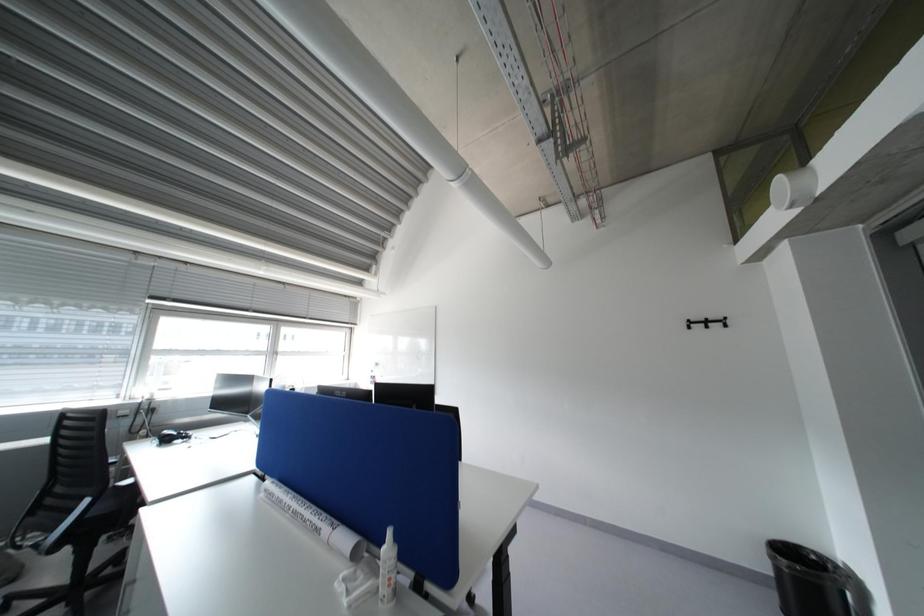
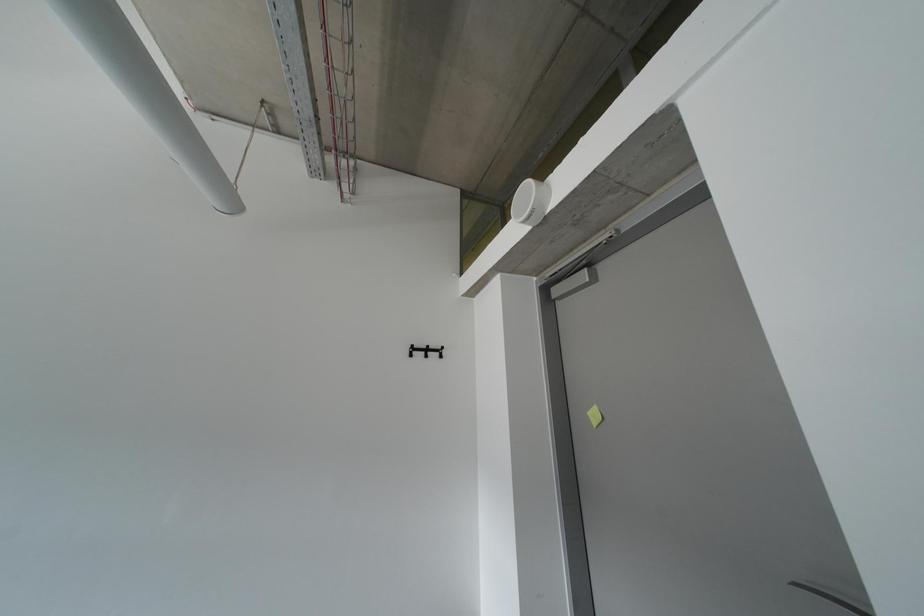
Question: The camera is either moving clockwise (left) or counter-clockwise (right) around the object. The first image is from the beginning of the video and the second image is from the end. Is the camera moving left or right when shooting the video?

Choices:
 (A) Left
 (B) Right

Answer: (A)